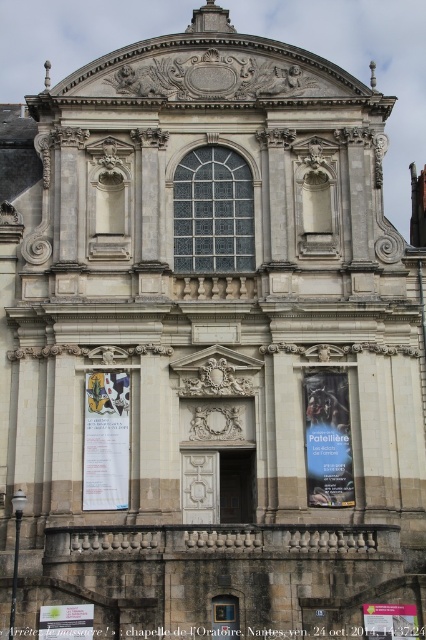
Is white paper poster at center shorter than green paper poster at lower left?

Incorrect, white paper poster at center's height does not fall short of green paper poster at lower left's.

Does white paper poster at center have a greater height compared to green paper poster at lower left?

Indeed, white paper poster at center has a greater height compared to green paper poster at lower left.

This screenshot has height=640, width=426. Describe the element at coordinates (106, 440) in the screenshot. I see `white paper poster at center` at that location.

Identify the location of white paper poster at center. The image size is (426, 640). (106, 440).

Is white paper poster at center closer to the viewer compared to blue glossy poster at center?

Yes.

Is point (98, 465) positioned behind point (336, 480)?

No, (98, 465) is in front of (336, 480).

Which is behind, point (126, 508) or point (322, 477)?

The point (322, 477) is more distant.

What are the coordinates of `white paper poster at center` in the screenshot? It's located at (106, 440).

In the scene shown: Who is positioned more to the right, blue glossy poster at center or green paper poster at lower left?

blue glossy poster at center is more to the right.

Looking at this image, who is more distant from viewer, (331, 381) or (92, 605)?

The point (331, 381) is more distant.

Locate an element on the screen. The width and height of the screenshot is (426, 640). blue glossy poster at center is located at coordinates (328, 440).